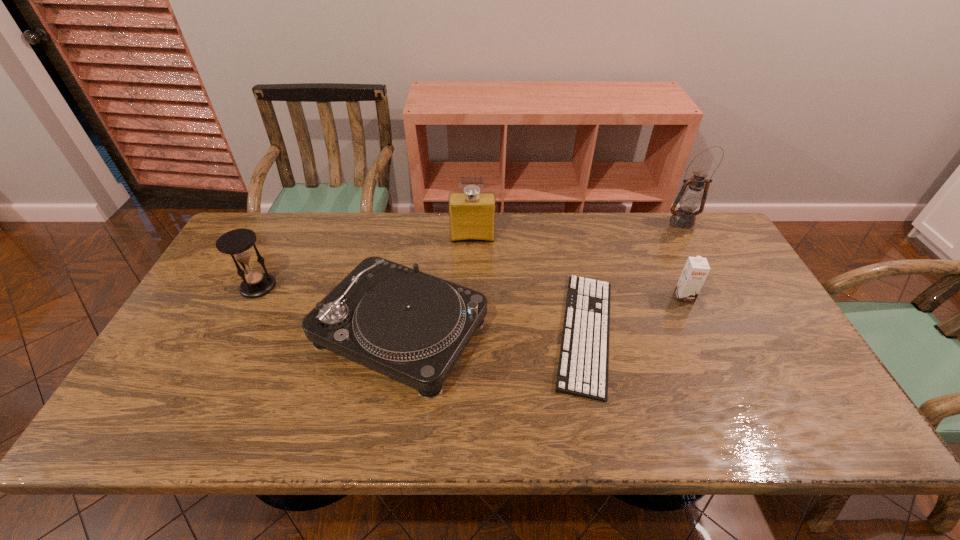
I want to click on the farthest object, so click(690, 198).

In order to click on the rightmost object in this screenshot , I will do `click(690, 198)`.

Image resolution: width=960 pixels, height=540 pixels. I want to click on the fifth nearest object, so click(x=472, y=214).

This screenshot has width=960, height=540. I want to click on the second tallest object, so click(472, 214).

Locate an element on the screen. The width and height of the screenshot is (960, 540). the third tallest object is located at coordinates (238, 243).

Locate an element on the screen. This screenshot has height=540, width=960. the leftmost object is located at coordinates (238, 243).

The height and width of the screenshot is (540, 960). What are the coordinates of `chocolate milk` in the screenshot? It's located at (694, 274).

Image resolution: width=960 pixels, height=540 pixels. In order to click on record player in this screenshot , I will do `click(411, 326)`.

Locate an element on the screen. This screenshot has height=540, width=960. computer keyboard is located at coordinates (584, 355).

The image size is (960, 540). I want to click on the shortest object, so click(584, 355).